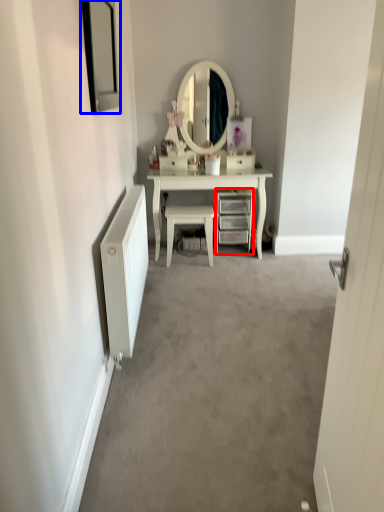
Question: Which object is further to the camera taking this photo, chest of drawers (highlighted by a red box) or picture frame (highlighted by a blue box)?

Choices:
 (A) chest of drawers
 (B) picture frame

Answer: (A)